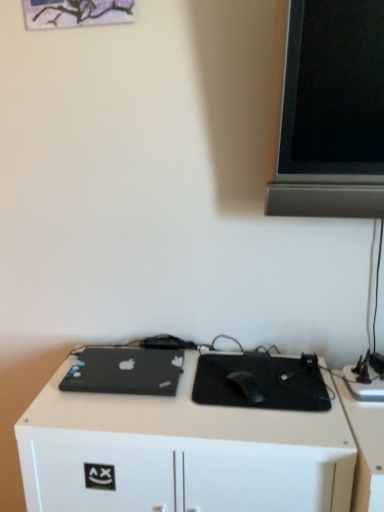
The height and width of the screenshot is (512, 384). In order to click on vacant position to the left of black matte mousepad at center in this screenshot , I will do `click(162, 407)`.